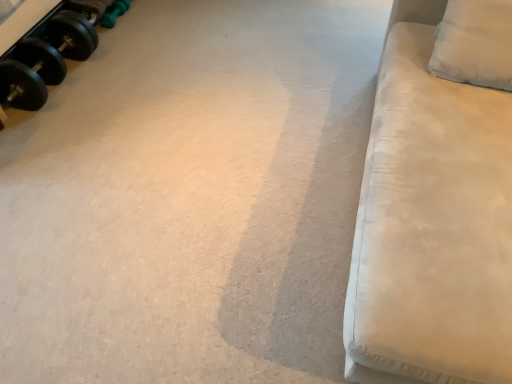
Question: Is black rubber dumbbell at upper left, the 1th dumbbell in the front-to-back sequence, a part of green rubber dumbbell at upper left, marked as the 2th dumbbell in a front-to-back arrangement?

Choices:
 (A) yes
 (B) no

Answer: (B)

Question: Is green rubber dumbbell at upper left, which appears as the first dumbbell when viewed from the back, in front of black rubber dumbbell at upper left, marked as the 2th dumbbell in a back-to-front arrangement?

Choices:
 (A) yes
 (B) no

Answer: (B)

Question: Does green rubber dumbbell at upper left, marked as the 2th dumbbell in a front-to-back arrangement, have a lesser height compared to black rubber dumbbell at upper left, marked as the 2th dumbbell in a back-to-front arrangement?

Choices:
 (A) no
 (B) yes

Answer: (B)

Question: From a real-world perspective, is green rubber dumbbell at upper left, which appears as the first dumbbell when viewed from the back, located beneath black rubber dumbbell at upper left, the 1th dumbbell in the front-to-back sequence?

Choices:
 (A) yes
 (B) no

Answer: (A)

Question: Are green rubber dumbbell at upper left, marked as the 2th dumbbell in a front-to-back arrangement, and black rubber dumbbell at upper left, the 1th dumbbell in the front-to-back sequence, making contact?

Choices:
 (A) yes
 (B) no

Answer: (B)

Question: Does green rubber dumbbell at upper left, which appears as the first dumbbell when viewed from the back, have a greater width compared to black rubber dumbbell at upper left, the 1th dumbbell in the front-to-back sequence?

Choices:
 (A) yes
 (B) no

Answer: (B)

Question: Is white fabric pillow at upper right closer to camera compared to black rubber dumbbell at upper left, marked as the 2th dumbbell in a back-to-front arrangement?

Choices:
 (A) yes
 (B) no

Answer: (A)

Question: Does white fabric pillow at upper right contain black rubber dumbbell at upper left, the 1th dumbbell in the front-to-back sequence?

Choices:
 (A) yes
 (B) no

Answer: (B)

Question: Is white fabric pillow at upper right further to the viewer compared to black rubber dumbbell at upper left, the 1th dumbbell in the front-to-back sequence?

Choices:
 (A) yes
 (B) no

Answer: (B)

Question: From the image's perspective, is white fabric pillow at upper right under black rubber dumbbell at upper left, the 1th dumbbell in the front-to-back sequence?

Choices:
 (A) no
 (B) yes

Answer: (B)

Question: Does white fabric pillow at upper right appear on the left side of black rubber dumbbell at upper left, marked as the 2th dumbbell in a back-to-front arrangement?

Choices:
 (A) no
 (B) yes

Answer: (A)

Question: Is white fabric pillow at upper right shorter than black rubber dumbbell at upper left, marked as the 2th dumbbell in a back-to-front arrangement?

Choices:
 (A) no
 (B) yes

Answer: (A)

Question: From the image's perspective, is white fabric couch at right under black rubber dumbbell at upper left, the 1th dumbbell in the front-to-back sequence?

Choices:
 (A) yes
 (B) no

Answer: (A)